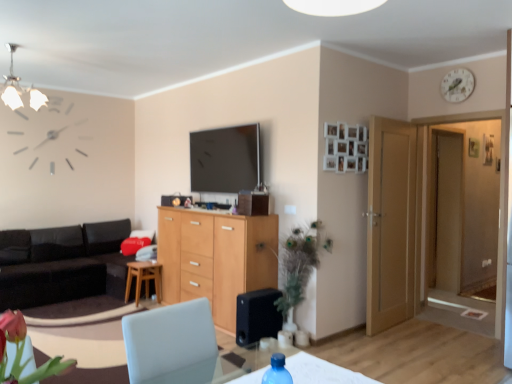
Question: Considering the positions of green leafy plant at center and wooden stool at center in the image, is green leafy plant at center bigger or smaller than wooden stool at center?

Choices:
 (A) big
 (B) small

Answer: (A)

Question: From a real-world perspective, is green leafy plant at center above or below wooden stool at center?

Choices:
 (A) above
 (B) below

Answer: (A)

Question: Based on their relative distances, which object is farther from the transparent glass door at right?

Choices:
 (A) black matte speaker at lower center
 (B) white wooden clock at upper right
 (C) transparent plastic water bottle at lower center
 (D) black leather couch at left
 (E) wooden stool at center

Answer: (D)

Question: Which object is positioned farthest from the metallic chandelier at upper left?

Choices:
 (A) light wood cabinet at center
 (B) black leather couch at left
 (C) white wooden clock at upper right
 (D) wooden stool at center
 (E) green leafy plant at center

Answer: (C)